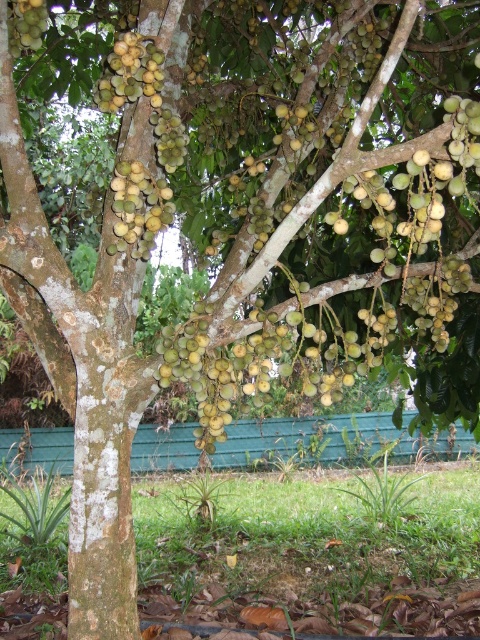
Question: Does green matte fruit at center appear under green matte fruit at upper left?

Choices:
 (A) yes
 (B) no

Answer: (A)

Question: Does green matte fruit at center have a lesser width compared to green matte fruit at upper left?

Choices:
 (A) no
 (B) yes

Answer: (B)

Question: Does green matte fruit at center have a smaller size compared to green matte fruit at upper left?

Choices:
 (A) no
 (B) yes

Answer: (A)

Question: Which of the following is the farthest from the observer?

Choices:
 (A) green matte fruit at center
 (B) green matte fruit at upper left

Answer: (B)